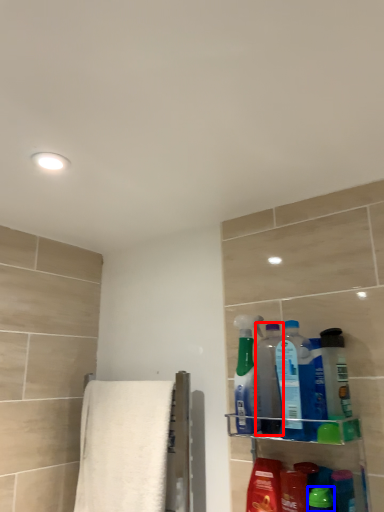
Question: Which object is closer to the camera taking this photo, cleaning product (highlighted by a red box) or cleaning product (highlighted by a blue box)?

Choices:
 (A) cleaning product
 (B) cleaning product

Answer: (B)